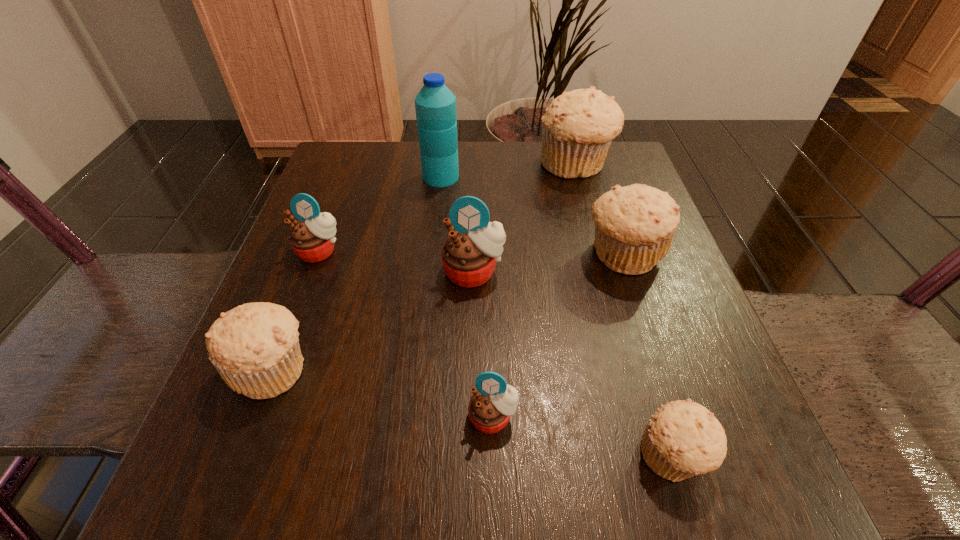
Find the location of a particular element. The height and width of the screenshot is (540, 960). muffin positioned at the far edge is located at coordinates (577, 129).

Where is `object located at the near edge`? Image resolution: width=960 pixels, height=540 pixels. object located at the near edge is located at coordinates click(x=682, y=439).

Find the location of a particular element. Image resolution: width=960 pixels, height=540 pixels. object at the far right corner is located at coordinates (577, 129).

Locate an element on the screen. object that is at the near right corner is located at coordinates (682, 439).

Where is `vacant area at the far edge of the desktop`? This screenshot has height=540, width=960. vacant area at the far edge of the desktop is located at coordinates (511, 185).

Locate an element on the screen. This screenshot has height=540, width=960. free space at the near edge of the desktop is located at coordinates tap(544, 479).

This screenshot has width=960, height=540. In the image, there is a desktop. What are the coordinates of `vacant space at the left edge` in the screenshot? It's located at (244, 397).

You are a GUI agent. You are given a task and a screenshot of the screen. Output one action in this format:
    pyautogui.click(x=<x>, y=<y>)
    Task: Click on the free region at the right edge of the desktop
    
    Given the screenshot: What is the action you would take?
    pyautogui.click(x=623, y=403)

At what (x,y) coordinates should I click in order to perform the action: click on vacant space at the far left corner. Please return your answer as a coordinate pair (x, y). This screenshot has width=960, height=540. Looking at the image, I should click on (374, 173).

The height and width of the screenshot is (540, 960). Find the location of `vacant space at the near left corner of the desktop`. vacant space at the near left corner of the desktop is located at coordinates (296, 513).